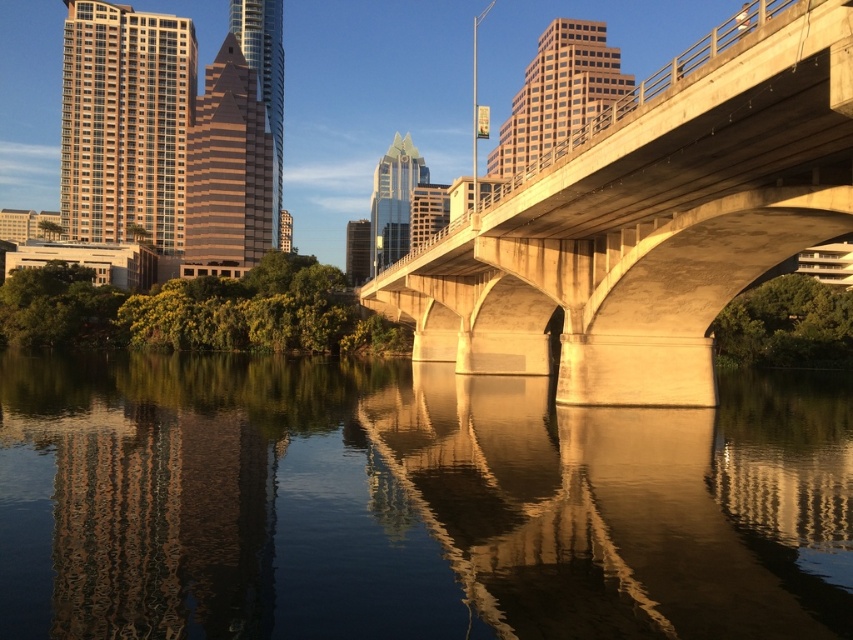
Is point (241, 440) positioned before point (585, 384)?

Yes, point (241, 440) is closer to viewer.

You are a GUI agent. You are given a task and a screenshot of the screen. Output one action in this format:
    pyautogui.click(x=<x>, y=<y>)
    Task: Click on the smooth water at center
    The height and width of the screenshot is (640, 853).
    Given the screenshot: What is the action you would take?
    pyautogui.click(x=412, y=502)